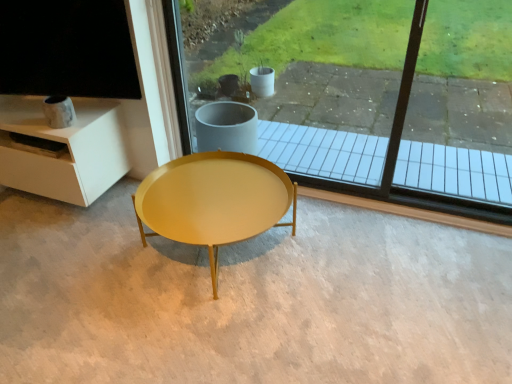
Where is `vacant space to the right of matte yellow table at center`? The height and width of the screenshot is (384, 512). vacant space to the right of matte yellow table at center is located at coordinates (358, 262).